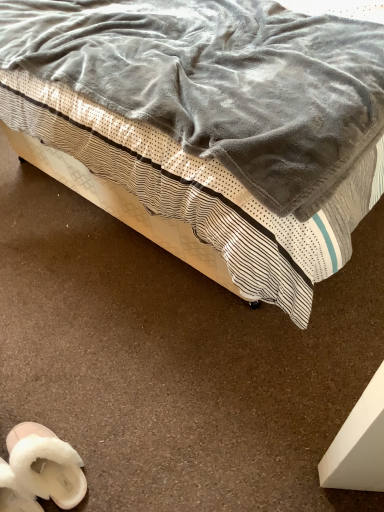
Question: Would you say velvet gray blanket at upper center is to the left or to the right of white fluffy slippers at lower left, marked as the first footwear in a right-to-left arrangement, in the picture?

Choices:
 (A) left
 (B) right

Answer: (B)

Question: From a real-world perspective, is velvet gray blanket at upper center positioned above or below white fluffy slippers at lower left, marked as the second footwear in a left-to-right arrangement?

Choices:
 (A) below
 (B) above

Answer: (B)

Question: Estimate the real-world distances between objects in this image. Which object is closer to the white fluffy slippers at lower left, positioned as the second footwear in right-to-left order?

Choices:
 (A) white fluffy slippers at lower left, marked as the second footwear in a left-to-right arrangement
 (B) velvet gray blanket at upper center

Answer: (A)

Question: Estimate the real-world distances between objects in this image. Which object is farther from the white fluffy slippers at lower left, marked as the second footwear in a left-to-right arrangement?

Choices:
 (A) white fluffy slippers at lower left, arranged as the 1th footwear when viewed from the left
 (B) velvet gray blanket at upper center

Answer: (B)